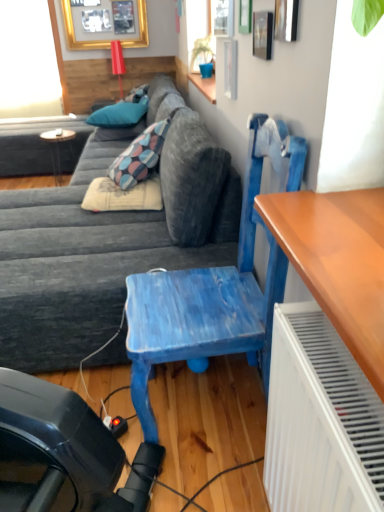
Question: Is clear glass window at upper center at the left side of wooden round table at left?

Choices:
 (A) yes
 (B) no

Answer: (B)

Question: From the image's perspective, is clear glass window at upper center below wooden round table at left?

Choices:
 (A) no
 (B) yes

Answer: (A)

Question: Is the depth of clear glass window at upper center greater than that of wooden round table at left?

Choices:
 (A) yes
 (B) no

Answer: (B)

Question: Considering the relative sizes of clear glass window at upper center and wooden round table at left in the image provided, is clear glass window at upper center thinner than wooden round table at left?

Choices:
 (A) yes
 (B) no

Answer: (A)

Question: Can you confirm if clear glass window at upper center is taller than wooden round table at left?

Choices:
 (A) yes
 (B) no

Answer: (B)

Question: Is teal fabric pillow at upper center, the 2th pillow positioned from the front, inside or outside of textured gray couch at center?

Choices:
 (A) inside
 (B) outside

Answer: (B)

Question: Considering the positions of teal fabric pillow at upper center, the second pillow positioned from the back, and textured gray couch at center in the image, is teal fabric pillow at upper center, the second pillow positioned from the back, bigger or smaller than textured gray couch at center?

Choices:
 (A) big
 (B) small

Answer: (B)

Question: Considering their positions, is teal fabric pillow at upper center, positioned as the 3th pillow in bottom-to-top order, located in front of or behind textured gray couch at center?

Choices:
 (A) front
 (B) behind

Answer: (B)

Question: Is point click(x=107, y=119) closer or farther from the camera than point click(x=228, y=205)?

Choices:
 (A) farther
 (B) closer

Answer: (A)

Question: Considering the positions of wooden round table at left and teal fabric pillow at upper center, the second pillow positioned from the back, in the image, is wooden round table at left taller or shorter than teal fabric pillow at upper center, the second pillow positioned from the back,?

Choices:
 (A) short
 (B) tall

Answer: (B)

Question: Is point (56, 151) positioned closer to the camera than point (139, 108)?

Choices:
 (A) farther
 (B) closer

Answer: (A)

Question: Based on their sizes in the image, would you say wooden round table at left is bigger or smaller than teal fabric pillow at upper center, the 2th pillow positioned from the front?

Choices:
 (A) big
 (B) small

Answer: (B)

Question: From a real-world perspective, relative to teal fabric pillow at upper center, the second pillow positioned from the back, is wooden round table at left vertically above or below?

Choices:
 (A) above
 (B) below

Answer: (B)

Question: From a real-world perspective, is green matte plant at upper center above or below transparent glass window screen at upper left?

Choices:
 (A) below
 (B) above

Answer: (B)

Question: From the image's perspective, is green matte plant at upper center above or below transparent glass window screen at upper left?

Choices:
 (A) above
 (B) below

Answer: (B)